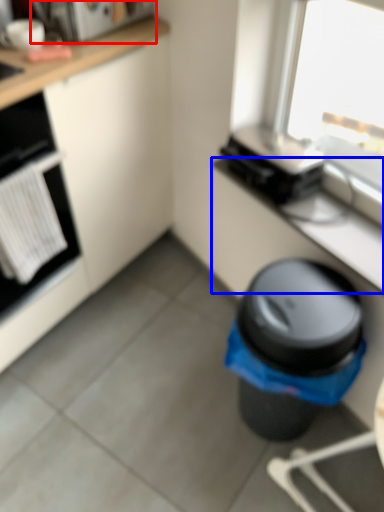
Question: Among these objects, which one is farthest to the camera, appliance (highlighted by a red box) or counter top (highlighted by a blue box)?

Choices:
 (A) appliance
 (B) counter top

Answer: (A)